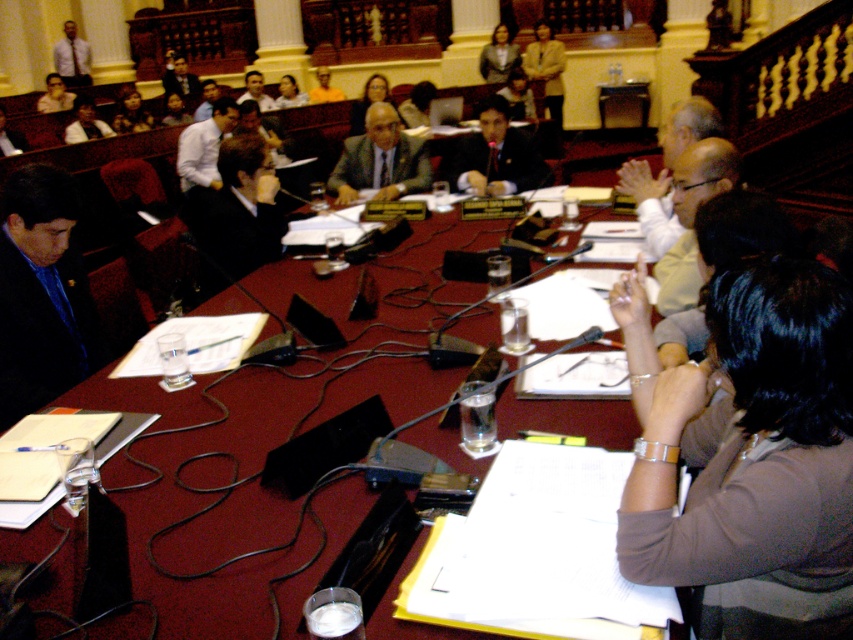
Is matte black suit at left thinner than light brown textured blazer at upper center?

Indeed, matte black suit at left has a lesser width compared to light brown textured blazer at upper center.

Find the location of a particular element. The height and width of the screenshot is (640, 853). matte black suit at left is located at coordinates (42, 294).

Does brown fabric shirt at lower right have a greater width compared to matte black suit at left?

Indeed, brown fabric shirt at lower right has a greater width compared to matte black suit at left.

Does brown fabric shirt at lower right have a lesser width compared to matte black suit at left?

No.

Locate an element on the screen. This screenshot has height=640, width=853. brown fabric shirt at lower right is located at coordinates (747, 452).

Is dark suit at center to the left of matte gray blazer at upper center from the viewer's perspective?

Yes, dark suit at center is to the left of matte gray blazer at upper center.

Is point (479, 150) farther from camera compared to point (512, 61)?

No, (479, 150) is in front of (512, 61).

You are a GUI agent. You are given a task and a screenshot of the screen. Output one action in this format:
    pyautogui.click(x=<x>, y=<y>)
    Task: Click on the dark suit at center
    
    Given the screenshot: What is the action you would take?
    [498, 156]